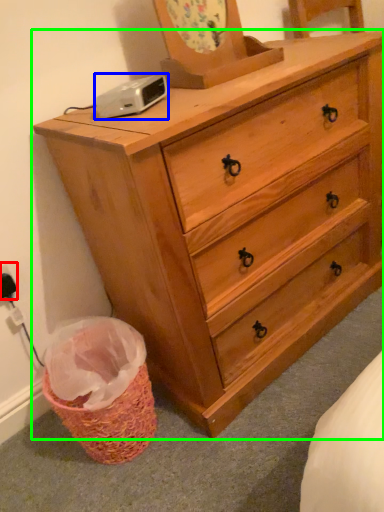
Question: Estimate the real-world distances between objects in this image. Which object is closer to electric outlet (highlighted by a red box), gadget (highlighted by a blue box) or chest of drawers (highlighted by a green box)?

Choices:
 (A) gadget
 (B) chest of drawers

Answer: (A)